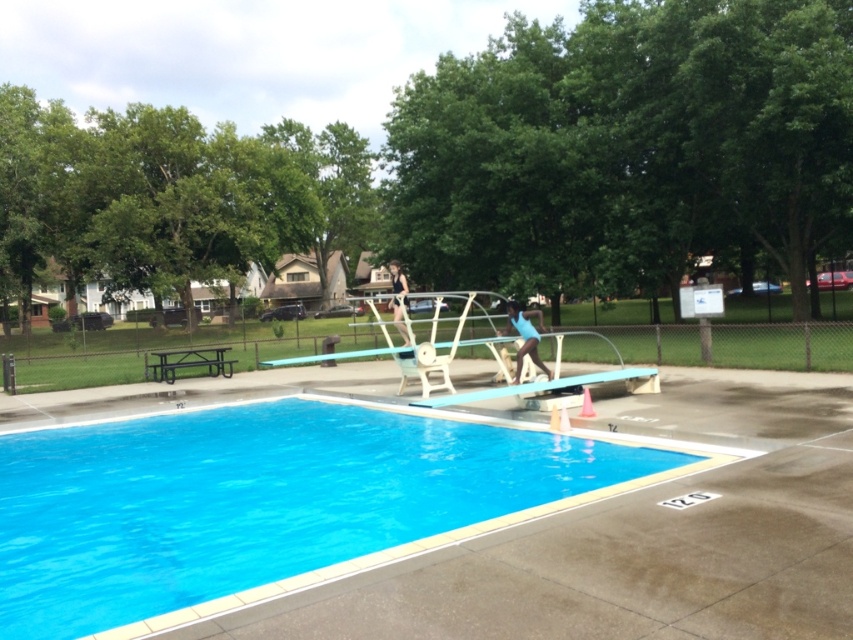
Question: Considering the relative positions of green leafy tree at upper center and green leafy tree at upper left in the image provided, where is green leafy tree at upper center located with respect to green leafy tree at upper left?

Choices:
 (A) right
 (B) left

Answer: (A)

Question: Observing the image, what is the correct spatial positioning of green leafy tree at upper center in reference to blue smooth pool at center?

Choices:
 (A) above
 (B) below

Answer: (A)

Question: Which point is closer to the camera?

Choices:
 (A) green leafy tree at upper center
 (B) black metal picnic table at lower left
 (C) green leafy tree at upper left
 (D) blue smooth pool at center

Answer: (D)

Question: Among these objects, which one is nearest to the camera?

Choices:
 (A) blue smooth pool at center
 (B) black metal picnic table at lower left
 (C) green leafy tree at upper center
 (D) green leafy tree at upper left

Answer: (A)

Question: Which object appears farthest from the camera in this image?

Choices:
 (A) green leafy tree at upper left
 (B) blue smooth pool at center

Answer: (A)

Question: Can you confirm if blue smooth pool at center is positioned below black metal picnic table at lower left?

Choices:
 (A) yes
 (B) no

Answer: (A)